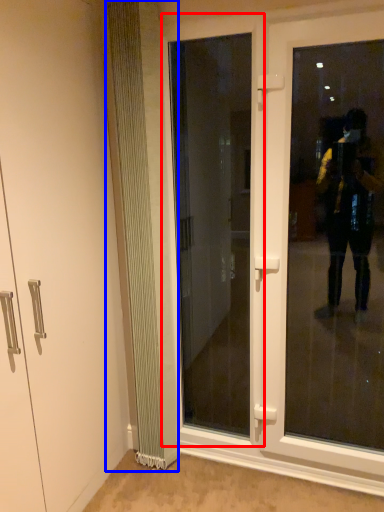
Question: Which object is closer to the camera taking this photo, door (highlighted by a red box) or radiator (highlighted by a blue box)?

Choices:
 (A) door
 (B) radiator

Answer: (B)